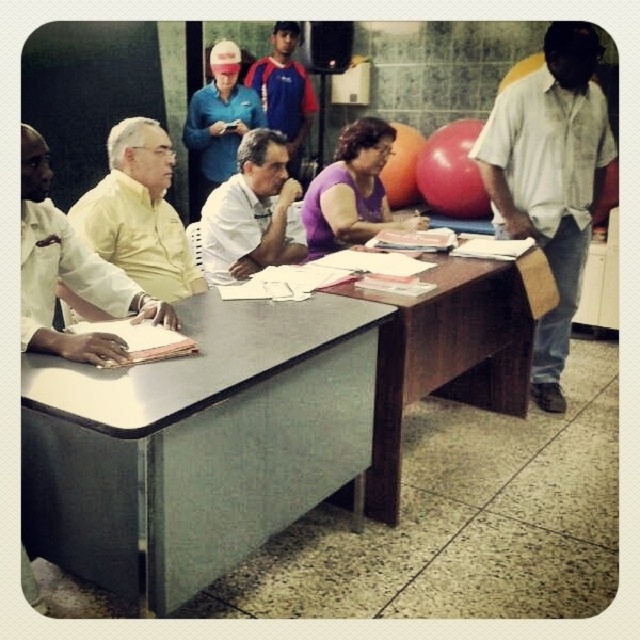
Question: Is white cotton shirt at right thinner than blue fabric shirt at upper center?

Choices:
 (A) no
 (B) yes

Answer: (A)

Question: Does yellow matte shirt at left have a lesser width compared to purple matte shirt at center?

Choices:
 (A) yes
 (B) no

Answer: (A)

Question: Which is farther from the blue fabric shirt at upper center?

Choices:
 (A) white matte shirt at center
 (B) metallic gray table at left
 (C) wooden at center
 (D) white cotton shirt at right

Answer: (B)

Question: Is purple matte shirt at center above blue fabric shirt at upper center?

Choices:
 (A) no
 (B) yes

Answer: (A)

Question: Which point appears farthest from the camera in this image?

Choices:
 (A) (369, 236)
 (B) (305, 125)
 (C) (566, 122)
 (D) (381, 506)

Answer: (B)

Question: Estimate the real-world distances between objects in this image. Which object is farther from the blue fabric shirt at upper center?

Choices:
 (A) white matte shirt at center
 (B) purple matte shirt at center
 (C) white cotton shirt at right

Answer: (C)